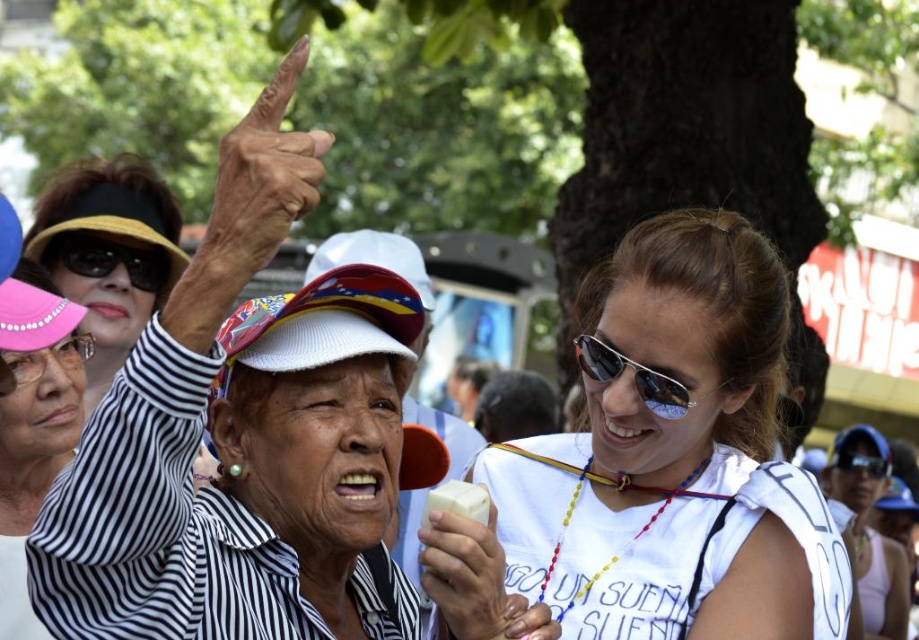
Question: Which object is positioned farthest from the white glossy tank top at center?

Choices:
 (A) transparent plastic goggles at upper left
 (B) sunglasses at center

Answer: (B)

Question: Can you confirm if matte black visor at upper left is bigger than white matte ice cream at lower center?

Choices:
 (A) yes
 (B) no

Answer: (A)

Question: Is white matte ice cream at lower center closer to camera compared to matte black sunglasses at upper left?

Choices:
 (A) yes
 (B) no

Answer: (A)

Question: Does white matte ice cream at lower center lie behind matte black sunglasses at upper left?

Choices:
 (A) no
 (B) yes

Answer: (A)

Question: Among these points, which one is nearest to the camera?

Choices:
 (A) (97, 369)
 (B) (83, 316)
 (C) (857, 467)

Answer: (B)

Question: Which point is farther to the camera?

Choices:
 (A) pink fabric hat at upper left
 (B) matte black visor at upper left
 (C) white matte ice cream at lower center
 (D) matte black sunglasses at upper left

Answer: (D)